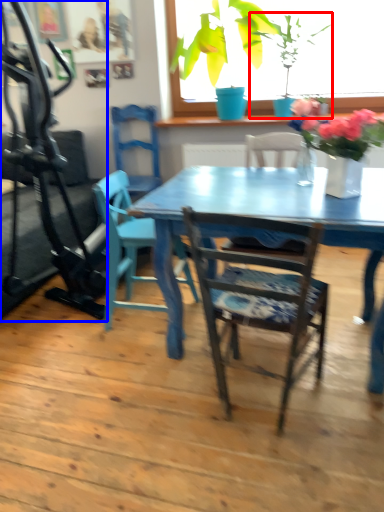
Question: Which point is closer to the camera, houseplant (highlighted by a red box) or treadmill (highlighted by a blue box)?

Choices:
 (A) houseplant
 (B) treadmill

Answer: (B)